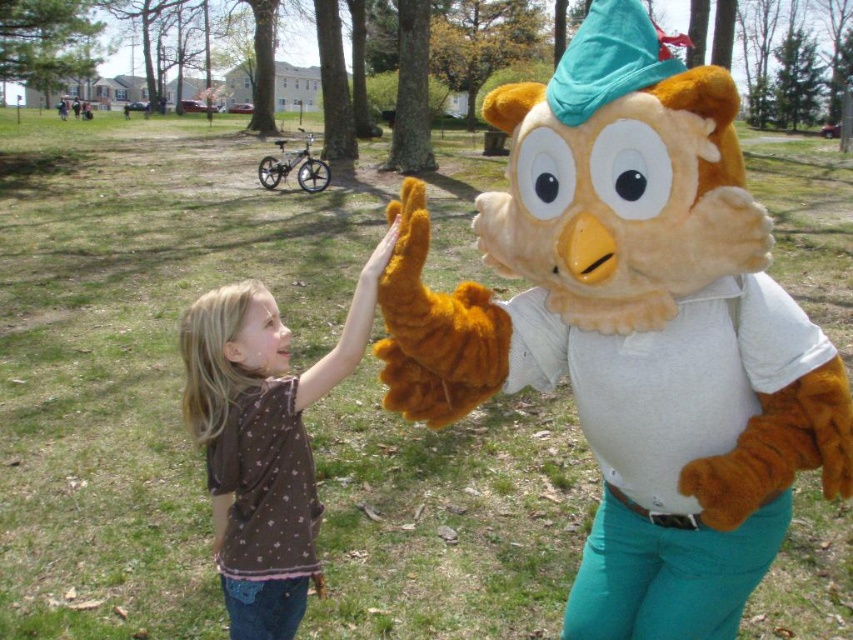
Question: Does fluffy brown owl at center have a larger size compared to brown fabric shirt at center?

Choices:
 (A) no
 (B) yes

Answer: (B)

Question: Is fluffy brown owl at center closer to the viewer compared to brown fabric shirt at center?

Choices:
 (A) no
 (B) yes

Answer: (B)

Question: Which point is farther to the camera?

Choices:
 (A) fluffy brown owl at center
 (B) brown fabric shirt at center

Answer: (B)

Question: Is fluffy brown owl at center to the right of brown fabric shirt at center from the viewer's perspective?

Choices:
 (A) yes
 (B) no

Answer: (A)